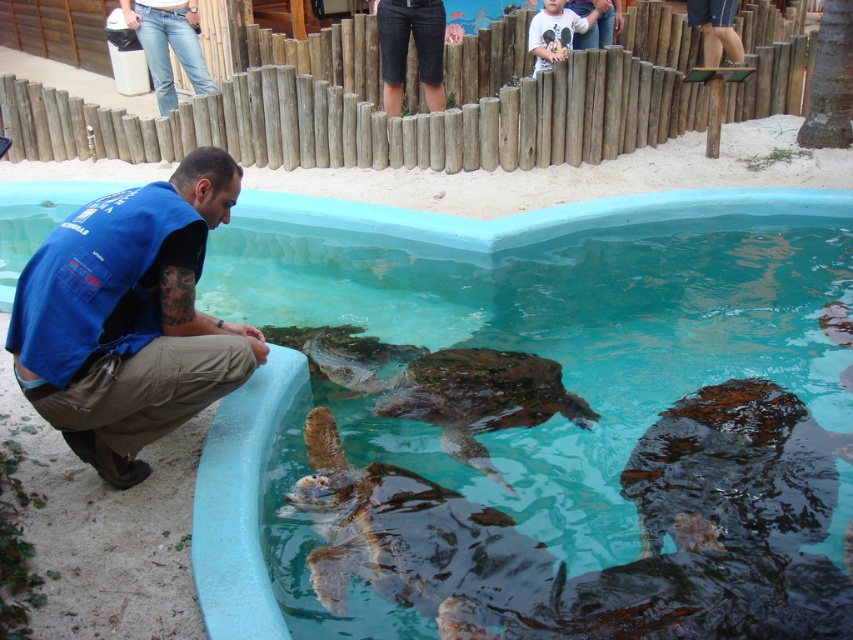
Does brown rough textured tortoise at center have a lesser width compared to jeans at center?

In fact, brown rough textured tortoise at center might be wider than jeans at center.

This screenshot has height=640, width=853. Describe the element at coordinates (613, 564) in the screenshot. I see `brown rough textured tortoise at center` at that location.

Find the location of `brown rough textured tortoise at center`. brown rough textured tortoise at center is located at coordinates (613, 564).

Who is positioned more to the right, smooth concrete pool at center or dark blue shirt at upper right?

dark blue shirt at upper right

Can you confirm if smooth concrete pool at center is thinner than dark blue shirt at upper right?

In fact, smooth concrete pool at center might be wider than dark blue shirt at upper right.

Between point (206, 600) and point (738, 38), which one is positioned in front?

Point (206, 600)

Where is `smooth concrete pool at center`? The image size is (853, 640). smooth concrete pool at center is located at coordinates (239, 508).

Which is above, blue fabric vest at lower left or brown rough tortoise at center?

Positioned higher is blue fabric vest at lower left.

This screenshot has height=640, width=853. What do you see at coordinates (129, 317) in the screenshot? I see `blue fabric vest at lower left` at bounding box center [129, 317].

The image size is (853, 640). What do you see at coordinates (129, 317) in the screenshot?
I see `blue fabric vest at lower left` at bounding box center [129, 317].

I want to click on blue fabric vest at lower left, so click(129, 317).